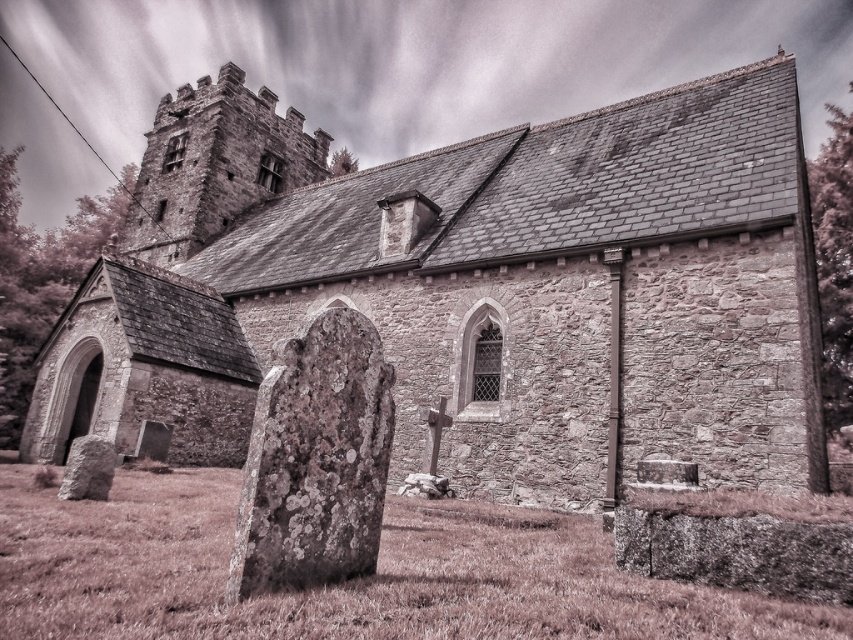
You are standing in front of the historic stone church and want to take a photo. You notice two points marked on the church wall at coordinates point (x=279, y=564) and point (x=91, y=496). Which point is closer to your camera position?

Point (x=279, y=564) is closer to the camera than point (x=91, y=496).